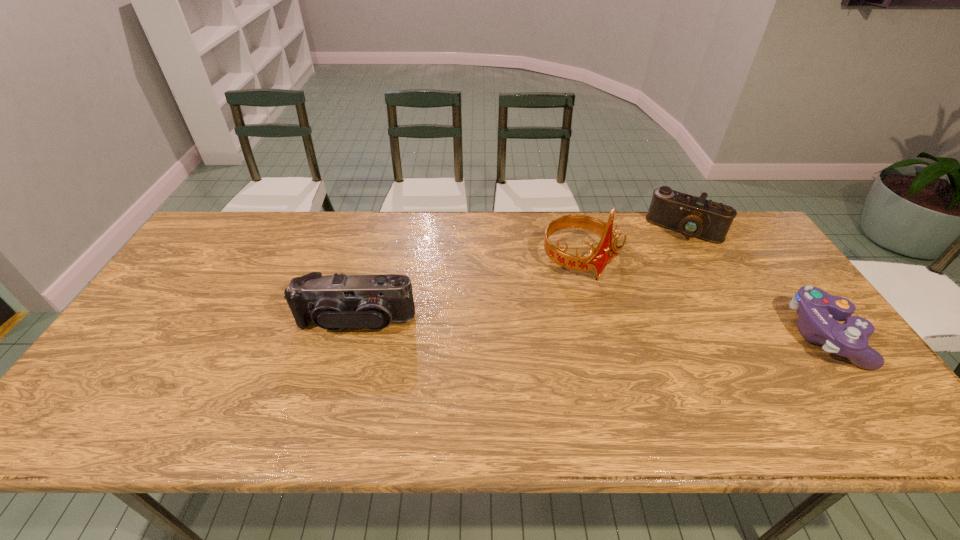
This screenshot has height=540, width=960. Identify the location of vacant space on the desktop that is between the camcorder and the rightmost object and is positioned on the front-facing side of the tiara. (639, 330).

Find the location of a particular element. The width and height of the screenshot is (960, 540). vacant space on the desktop that is between the camcorder and the rightmost object and is positioned on the lens of the camera is located at coordinates (636, 330).